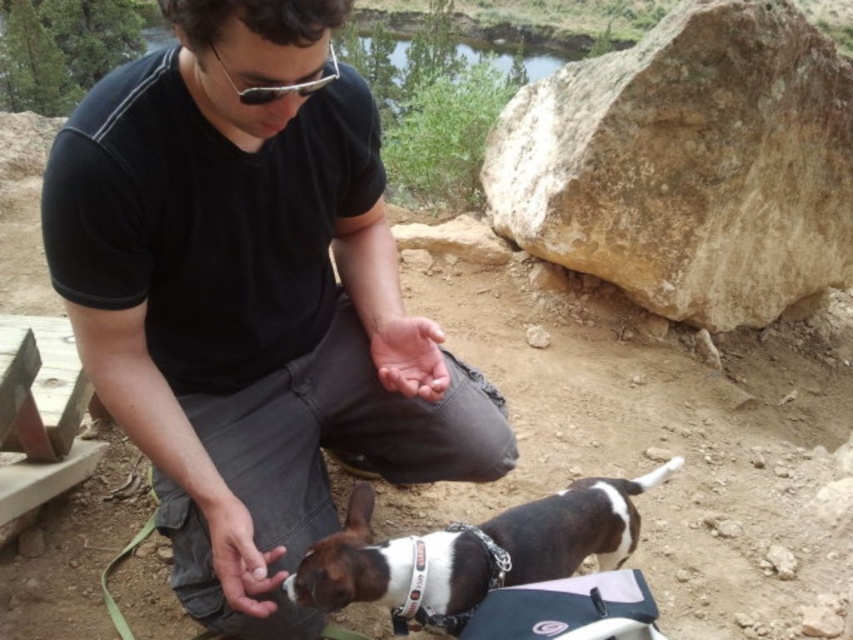
Question: Does black cotton shirt at center appear over brown rough rock at upper right?

Choices:
 (A) no
 (B) yes

Answer: (A)

Question: Which object is positioned farthest from the black cotton shirt at center?

Choices:
 (A) white and brown fur at lower center
 (B) matte black goggles at upper center
 (C) brown rough rock at upper right

Answer: (C)

Question: Based on their relative distances, which object is nearer to the white and brown fur at lower center?

Choices:
 (A) brown rough rock at upper right
 (B) matte black goggles at upper center
 (C) black cotton shirt at center

Answer: (C)

Question: Is brown rough rock at upper right smaller than matte black goggles at upper center?

Choices:
 (A) no
 (B) yes

Answer: (A)

Question: Which object is the farthest from the matte black goggles at upper center?

Choices:
 (A) white and brown fur at lower center
 (B) black cotton shirt at center
 (C) brown rough rock at upper right

Answer: (C)

Question: Is white and brown fur at lower center in front of matte black goggles at upper center?

Choices:
 (A) yes
 (B) no

Answer: (B)